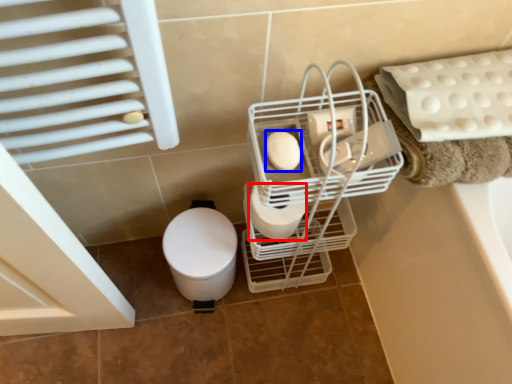
Question: Which of the following is the closest to the observer, toilet paper (highlighted by a red box) or toilet paper (highlighted by a blue box)?

Choices:
 (A) toilet paper
 (B) toilet paper

Answer: (B)